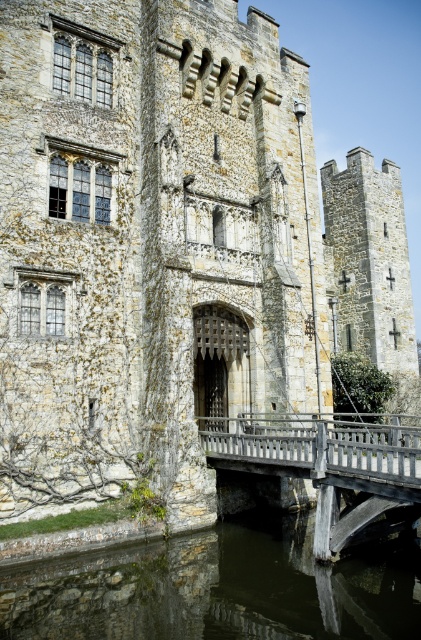
Question: Is dark stone water at lower center positioned behind wooden bridge at center?

Choices:
 (A) yes
 (B) no

Answer: (B)

Question: Is dark stone water at lower center above wooden bridge at center?

Choices:
 (A) no
 (B) yes

Answer: (A)

Question: Does dark stone water at lower center have a larger size compared to wooden bridge at center?

Choices:
 (A) yes
 (B) no

Answer: (B)

Question: Which point is closer to the camera?

Choices:
 (A) (157, 609)
 (B) (354, 420)

Answer: (A)